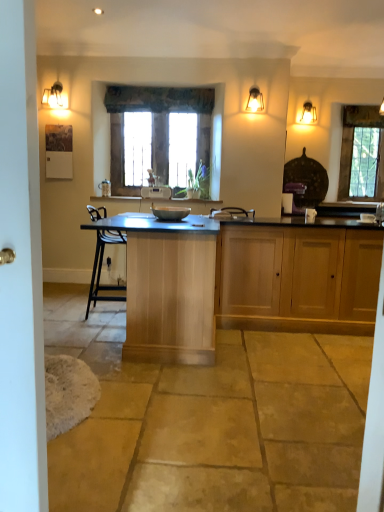
Where is `free space in front of light wood cabinet at center, the 1th cabinetry when ordered from left to right`? The image size is (384, 512). free space in front of light wood cabinet at center, the 1th cabinetry when ordered from left to right is located at coordinates point(196,398).